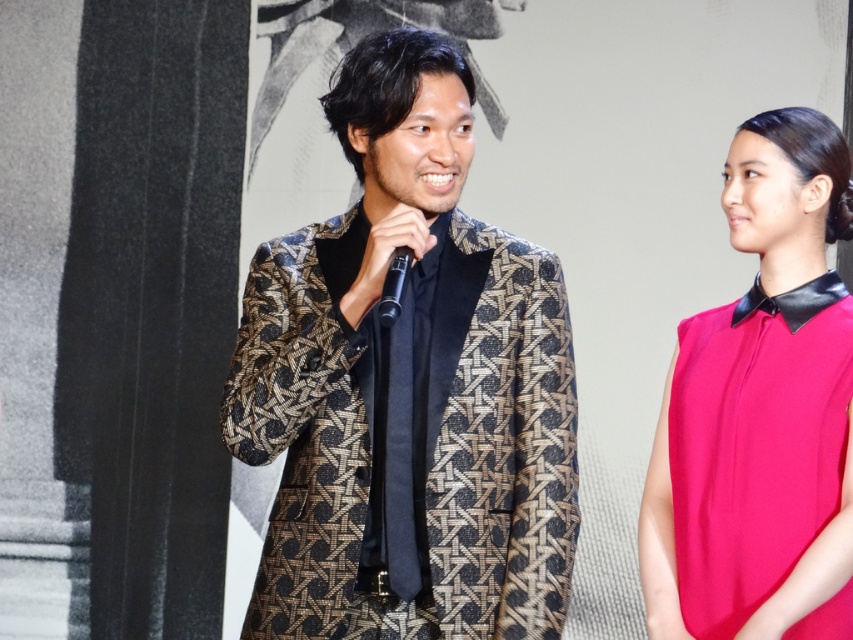
Question: Observing the image, what is the correct spatial positioning of gold-patterned suit at center in reference to matte pink blouse at right?

Choices:
 (A) left
 (B) right

Answer: (A)

Question: Among these objects, which one is nearest to the camera?

Choices:
 (A) gold-patterned suit at center
 (B) matte pink blouse at right

Answer: (A)

Question: Among these objects, which one is farthest from the camera?

Choices:
 (A) matte pink blouse at right
 (B) gold-patterned suit at center

Answer: (A)

Question: Can you confirm if gold-patterned suit at center is positioned below matte pink blouse at right?

Choices:
 (A) no
 (B) yes

Answer: (A)

Question: Can you confirm if gold-patterned suit at center is wider than matte pink blouse at right?

Choices:
 (A) yes
 (B) no

Answer: (A)